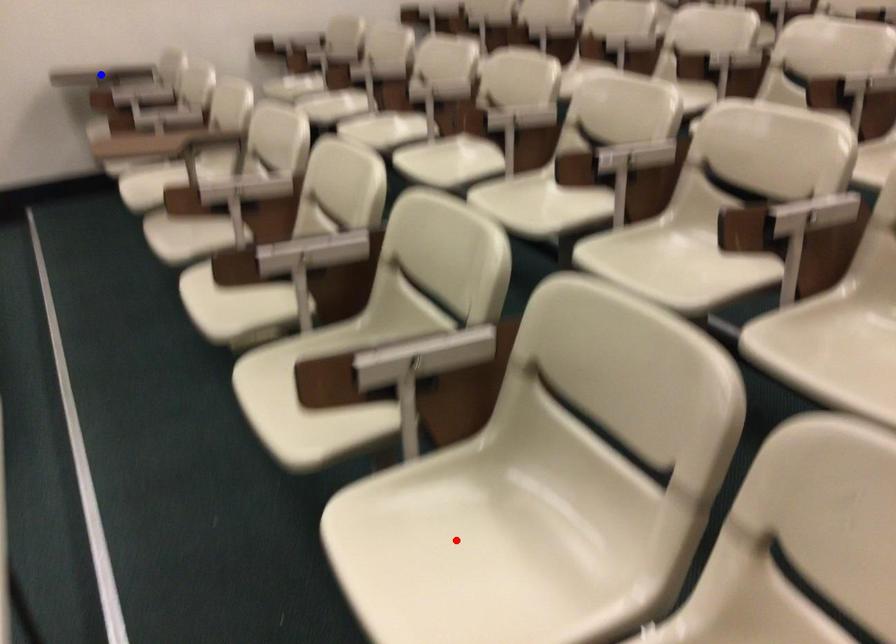
Question: Two points are marked on the image. Which point is closer to the camera?

Choices:
 (A) Blue point is closer.
 (B) Red point is closer.

Answer: (B)